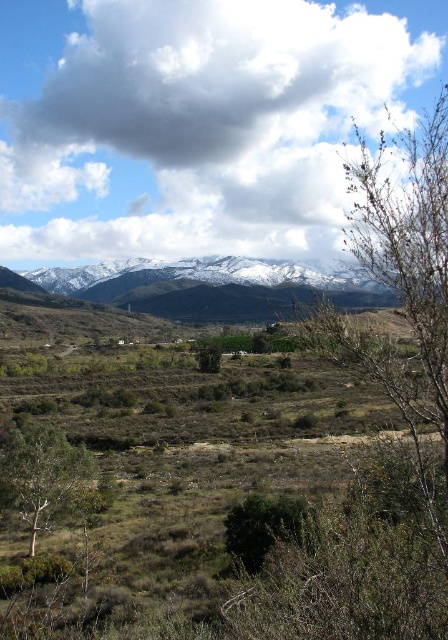
You are a hiker who wants to take a photo of the green leafy tree at lower left and the bare branches at right in the same frame. The camera you have can only focus on objects within 100 meters. Will both objects be in focus?

The bare branches at right is 128.04 meters away from green leafy tree at lower left. Since the distance between them exceeds 100 meters, the camera cannot focus on both objects simultaneously, so they cannot be in focus in the same frame.

You are an environmental scientist analyzing the landscape. You observe the bare branches at right and the green leafy tree at lower left. Which of these two trees has a greater height?

The bare branches at right has a larger size compared to the green leafy tree at lower left, so it is taller.